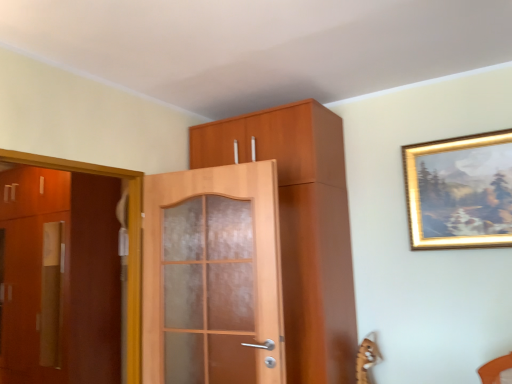
Question: Looking at the image, does matte wood door at center, positioned as the 1th door in right-to-left order, seem bigger or smaller compared to gold-framed painting at upper right?

Choices:
 (A) big
 (B) small

Answer: (A)

Question: Considering the positions of point (225, 218) and point (458, 200), is point (225, 218) closer or farther from the camera than point (458, 200)?

Choices:
 (A) farther
 (B) closer

Answer: (A)

Question: Estimate the real-world distances between objects in this image. Which object is closer to the matte wood door at center, which appears as the first door when viewed from the front?

Choices:
 (A) matte brown cabinet at left, which is counted as the 2th door, starting from the right
 (B) gold-framed painting at upper right
 (C) matte wood cabinet at center

Answer: (C)

Question: Estimate the real-world distances between objects in this image. Which object is farther from the matte brown cabinet at left, the 1th door positioned from the back?

Choices:
 (A) gold-framed painting at upper right
 (B) matte wood cabinet at center
 (C) matte wood door at center, which is counted as the second door, starting from the left

Answer: (A)